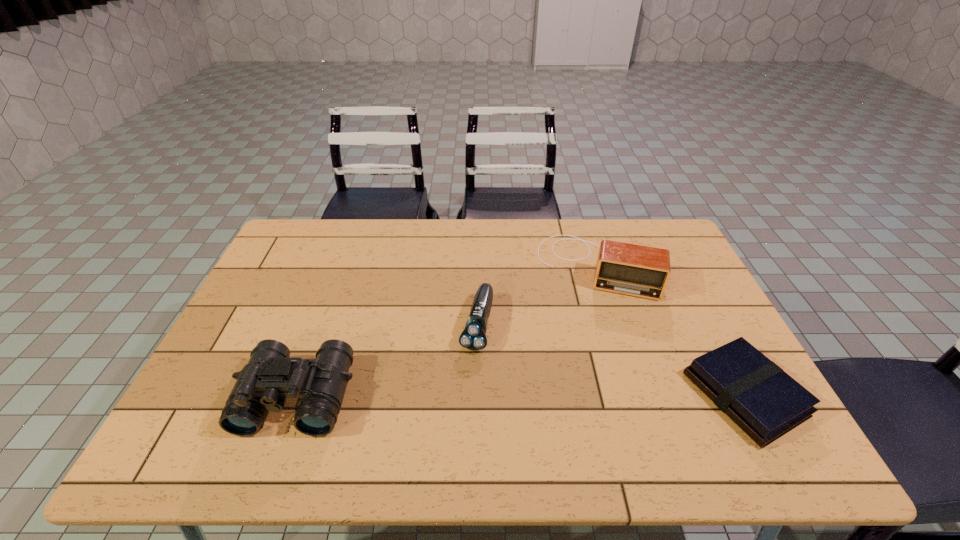
Find the location of a particular element. The image size is (960, 540). object located at the far right corner is located at coordinates (642, 271).

Locate an element on the screen. Image resolution: width=960 pixels, height=540 pixels. object located at the near right corner is located at coordinates (756, 394).

This screenshot has height=540, width=960. I want to click on vacant area at the far edge, so click(451, 222).

I want to click on vacant space at the near edge of the desktop, so click(x=516, y=414).

You are a GUI agent. You are given a task and a screenshot of the screen. Output one action in this format:
    pyautogui.click(x=<x>, y=<y>)
    Task: Click on the free space at the left edge
    The width and height of the screenshot is (960, 540).
    Given the screenshot: What is the action you would take?
    pyautogui.click(x=211, y=377)

Identify the location of vacant space at the right edge of the desktop. The height and width of the screenshot is (540, 960). (683, 339).

At what (x,y) coordinates should I click in order to perform the action: click on vacant space at the far left corner of the desktop. Please return your answer as a coordinate pair (x, y). Looking at the image, I should click on (310, 229).

Locate an element on the screen. This screenshot has width=960, height=540. free space at the near left corner of the desktop is located at coordinates (208, 408).

I want to click on free spot between the electric shaver and the shortest object, so click(611, 360).

Locate an element on the screen. The width and height of the screenshot is (960, 540). vacant space that's between the tallest object and the third shortest object is located at coordinates (446, 332).